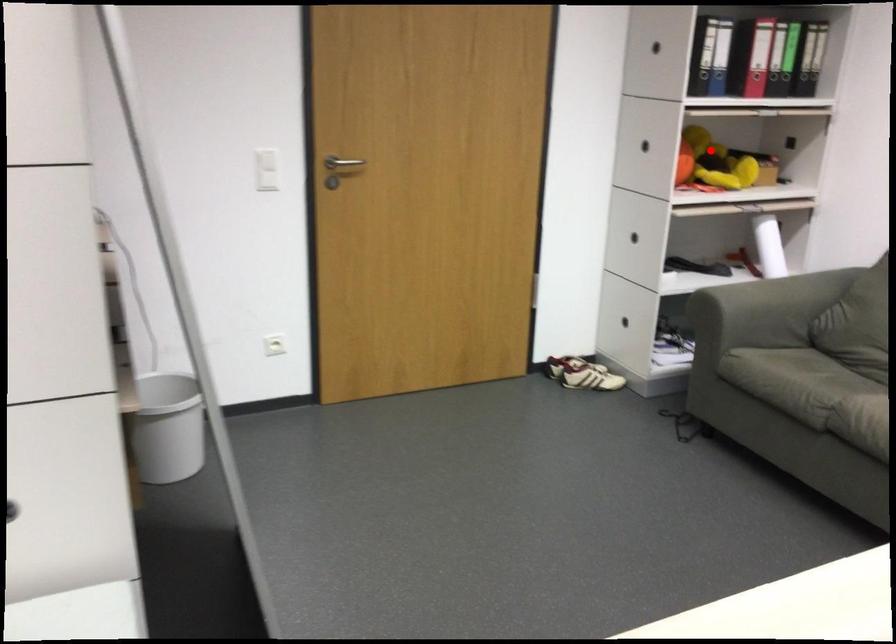
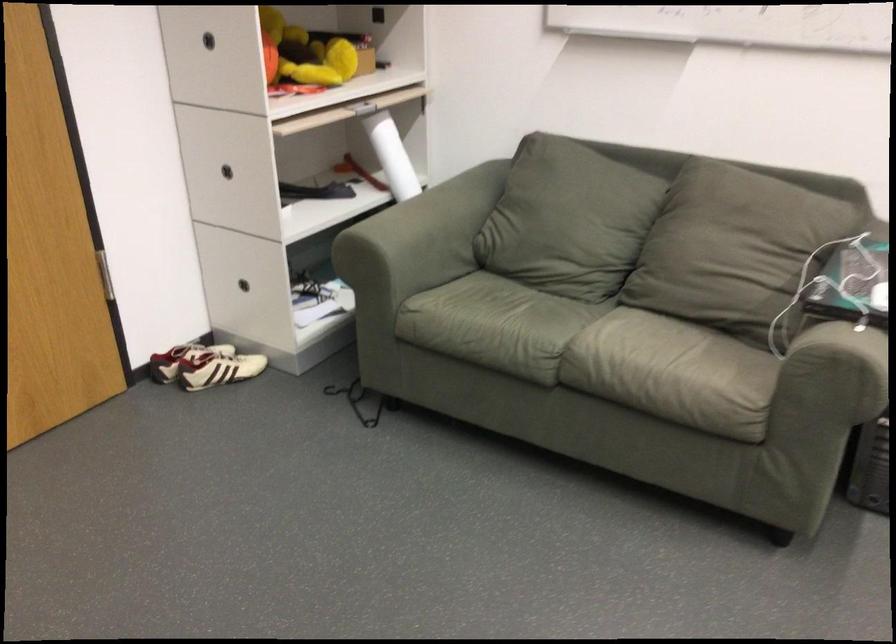
Question: I am providing you with two images of the same scene from different viewpoints. In image1, a red point is highlighted. Considering the same 3D point in image2, which of the following is correct?

Choices:
 (A) It is closer
 (B) It is farther

Answer: (A)